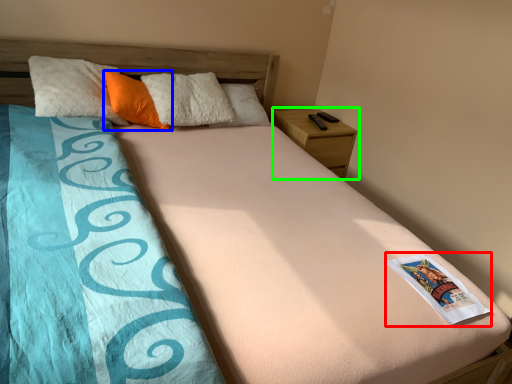
Question: Based on their relative distances, which object is nearer to paperback book (highlighted by a red box)? Choose from pillow (highlighted by a blue box) and nightstand (highlighted by a green box).

Choices:
 (A) pillow
 (B) nightstand

Answer: (B)